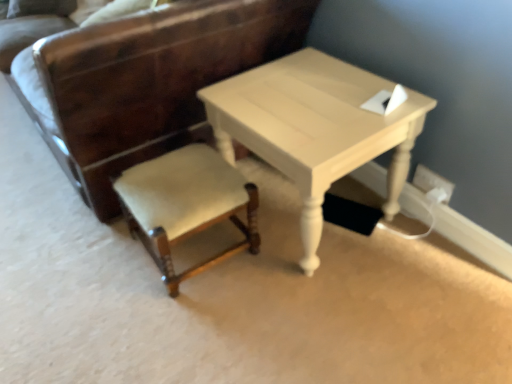
The width and height of the screenshot is (512, 384). In order to click on vacant area that lies in front of velvet beige stool at center, which appears as the 1th chair when ordered from the bottom in this screenshot , I will do `click(192, 332)`.